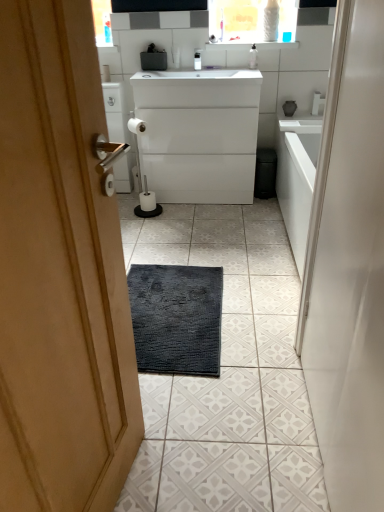
This screenshot has width=384, height=512. What do you see at coordinates (199, 134) in the screenshot? I see `white glossy cabinet at center` at bounding box center [199, 134].

Measure the distance between white matte toilet paper at center, the 1th toilet paper from the left, and camera.

white matte toilet paper at center, the 1th toilet paper from the left, and camera are 2.65 meters apart from each other.

The image size is (384, 512). I want to click on white matte toilet paper at center, the 2th toilet paper from the top, so click(147, 201).

Identify the location of white glossy cabinet at center. The image size is (384, 512). (199, 134).

From the image's perspective, is white matte toilet paper at center, the 1th toilet paper from the left, on white glossy cabinet at center?

Yes, from the image's perspective, white matte toilet paper at center, the 1th toilet paper from the left, is on top of white glossy cabinet at center.

Is white matte toilet paper at center, the second toilet paper from the bottom, turned away from white glossy cabinet at center?

No, white glossy cabinet at center is not at the back of white matte toilet paper at center, the second toilet paper from the bottom.

In the image, is white matte toilet paper at center, the second toilet paper from the bottom, positioned in front of or behind white glossy cabinet at center?

white matte toilet paper at center, the second toilet paper from the bottom, is behind white glossy cabinet at center.

Can you tell me how much white matte toilet paper at center, the second toilet paper from the bottom, and white glossy cabinet at center differ in facing direction?

The angular difference between white matte toilet paper at center, the second toilet paper from the bottom, and white glossy cabinet at center is 0.134 degrees.

Between white glossy cabinet at center and white glossy medicine cabinet at upper center, which one has larger size?

With larger size is white glossy cabinet at center.

Is white glossy medicine cabinet at upper center located within white glossy cabinet at center?

Actually, white glossy medicine cabinet at upper center is outside white glossy cabinet at center.

Which point is more forward, (224, 119) or (219, 5)?

The point (224, 119) is closer to the camera.

Does white glossy cabinet at center touch white glossy medicine cabinet at upper center?

No, white glossy cabinet at center is not next to white glossy medicine cabinet at upper center.

Consider the image. Does transparent plastic bottle at upper center appear on the right side of white glossy medicine cabinet at upper center?

In fact, transparent plastic bottle at upper center is to the left of white glossy medicine cabinet at upper center.

Is white glossy medicine cabinet at upper center at the back of transparent plastic bottle at upper center?

No, transparent plastic bottle at upper center is not facing the opposite direction of white glossy medicine cabinet at upper center.

From the image's perspective, is transparent plastic bottle at upper center beneath white glossy medicine cabinet at upper center?

Indeed, from the image's perspective, transparent plastic bottle at upper center is shown beneath white glossy medicine cabinet at upper center.

Consider the image. Between transparent plastic bottle at upper center and white glossy medicine cabinet at upper center, which one has more height?

Standing taller between the two is white glossy medicine cabinet at upper center.

Which of these two, white matte toilet paper at center, which is the second toilet paper from right to left, or transparent plastic bottle at upper center, is wider?

transparent plastic bottle at upper center is wider.

Who is smaller, white matte toilet paper at center, which is the second toilet paper from right to left, or transparent plastic bottle at upper center?

Smaller between the two is white matte toilet paper at center, which is the second toilet paper from right to left.

Can you tell me how much white matte toilet paper at center, which is the second toilet paper from right to left, and transparent plastic bottle at upper center differ in facing direction?

white matte toilet paper at center, which is the second toilet paper from right to left, and transparent plastic bottle at upper center are facing 0.432 degrees away from each other.

Is white glossy cabinet at center directly adjacent to transparent plastic bottle at upper center?

white glossy cabinet at center and transparent plastic bottle at upper center are not in contact.

From a real-world perspective, which object rests below the other?

In real-world perspective, white glossy cabinet at center is lower.

Between white glossy cabinet at center and transparent plastic bottle at upper center, which one has larger width?

Wider between the two is white glossy cabinet at center.

From the image's perspective, is white glossy cabinet at center on top of transparent plastic bottle at upper center?

No, from the image's perspective, white glossy cabinet at center is not on top of transparent plastic bottle at upper center.

Considering the positions of objects white glossy cabinet at center and white matte toilet paper at center, which is counted as the 1th toilet paper, starting from the right, in the image provided, who is more to the right, white glossy cabinet at center or white matte toilet paper at center, which is counted as the 1th toilet paper, starting from the right,?

Positioned to the right is white glossy cabinet at center.

Consider the image. Is white glossy cabinet at center positioned far away from white matte toilet paper at center, arranged as the 2th toilet paper when viewed from the left?

No, white glossy cabinet at center is not far away from white matte toilet paper at center, arranged as the 2th toilet paper when viewed from the left.

Can you confirm if white glossy cabinet at center is bigger than white matte toilet paper at center, which is counted as the 1th toilet paper, starting from the right?

Indeed, white glossy cabinet at center has a larger size compared to white matte toilet paper at center, which is counted as the 1th toilet paper, starting from the right.

From a real-world perspective, who is located lower, white glossy cabinet at center or white matte toilet paper at center, the 1th toilet paper when ordered from bottom to top?

white matte toilet paper at center, the 1th toilet paper when ordered from bottom to top, is physically lower.

Image resolution: width=384 pixels, height=512 pixels. In order to click on toilet paper that is under the white matte toilet paper at center, the second toilet paper from the bottom (from a real-world perspective) in this screenshot , I will do `click(147, 201)`.

Can you confirm if white matte toilet paper at center, which is counted as the 1th toilet paper, starting from the right, is bigger than white matte toilet paper at center, the second toilet paper from the bottom?

Yes, white matte toilet paper at center, which is counted as the 1th toilet paper, starting from the right, is bigger than white matte toilet paper at center, the second toilet paper from the bottom.

Is point (144, 201) positioned before point (109, 75)?

No, it is not.

Considering the relative sizes of white matte toilet paper at center, which is counted as the 1th toilet paper, starting from the right, and white matte toilet paper at center, which is the second toilet paper from right to left, in the image provided, is white matte toilet paper at center, which is counted as the 1th toilet paper, starting from the right, wider than white matte toilet paper at center, which is the second toilet paper from right to left,?

Indeed, white matte toilet paper at center, which is counted as the 1th toilet paper, starting from the right, has a greater width compared to white matte toilet paper at center, which is the second toilet paper from right to left.

Find the location of a particular element. This screenshot has height=512, width=384. the 2nd toilet paper behind when counting from the white glossy cabinet at center is located at coordinates (105, 73).

The image size is (384, 512). I want to click on bathroom cabinet below the white glossy medicine cabinet at upper center (from the image's perspective), so click(x=199, y=134).

Estimate the real-world distances between objects in this image. Which object is closer to transparent plastic bottle at upper center, white glossy cabinet at center or white glossy medicine cabinet at upper center?

Among the two, white glossy medicine cabinet at upper center is located nearer to transparent plastic bottle at upper center.

Considering their positions, is transparent plastic bottle at upper center positioned further to white glossy cabinet at center than white matte toilet paper at center, the 1th toilet paper from the top?

Among the two, white matte toilet paper at center, the 1th toilet paper from the top, is located further to white glossy cabinet at center.

Considering their positions, is white matte toilet paper at center, which is the second toilet paper from right to left, positioned further to white glossy medicine cabinet at upper center than white matte toilet paper at center, arranged as the 2th toilet paper when viewed from the left?

white matte toilet paper at center, arranged as the 2th toilet paper when viewed from the left, is further to white glossy medicine cabinet at upper center.

Based on the photo, estimate the real-world distances between objects in this image. Which object is closer to transparent plastic bottle at upper center, white matte toilet paper at center, the 2th toilet paper from the top, or white glossy medicine cabinet at upper center?

Among the two, white glossy medicine cabinet at upper center is located nearer to transparent plastic bottle at upper center.

Which object lies further to the anchor point white matte toilet paper at center, which is counted as the 1th toilet paper, starting from the right, white glossy cabinet at center or white glossy medicine cabinet at upper center?

white glossy medicine cabinet at upper center.

Considering their positions, is white glossy medicine cabinet at upper center positioned further to transparent plastic bottle at upper center than white matte toilet paper at center, the 1th toilet paper from the top?

The object further to transparent plastic bottle at upper center is white matte toilet paper at center, the 1th toilet paper from the top.

Estimate the real-world distances between objects in this image. Which object is closer to transparent plastic bottle at upper center, white matte toilet paper at center, the 1th toilet paper from the left, or white matte toilet paper at center, arranged as the 2th toilet paper when viewed from the left?

white matte toilet paper at center, the 1th toilet paper from the left.

From the image, which object appears to be nearer to white glossy cabinet at center, white matte toilet paper at center, which is counted as the 1th toilet paper, starting from the right, or transparent plastic bottle at upper center?

white matte toilet paper at center, which is counted as the 1th toilet paper, starting from the right, lies closer to white glossy cabinet at center than the other object.

Find the location of `toiletry located between white matte toilet paper at center, the 1th toilet paper from the top, and white glossy medicine cabinet at upper center in the left-right direction`. toiletry located between white matte toilet paper at center, the 1th toilet paper from the top, and white glossy medicine cabinet at upper center in the left-right direction is located at coordinates (253, 57).

Find the location of a particular element. Image resolution: width=384 pixels, height=512 pixels. toiletry between white glossy medicine cabinet at upper center and white matte toilet paper at center, which is counted as the 1th toilet paper, starting from the right, vertically is located at coordinates (253, 57).

Identify the location of bathroom cabinet between transparent plastic bottle at upper center and white matte toilet paper at center, the 2th toilet paper from the top, in the vertical direction. This screenshot has width=384, height=512. (199, 134).

I want to click on toilet paper between white glossy medicine cabinet at upper center and white matte toilet paper at center, which is counted as the 1th toilet paper, starting from the right, in the up-down direction, so click(105, 73).